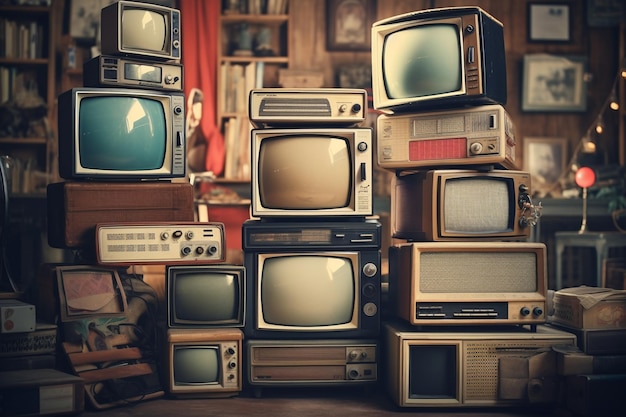
Find the location of `television`. television is located at coordinates (444, 77), (290, 159), (129, 131), (146, 12), (203, 297), (208, 358), (320, 295).